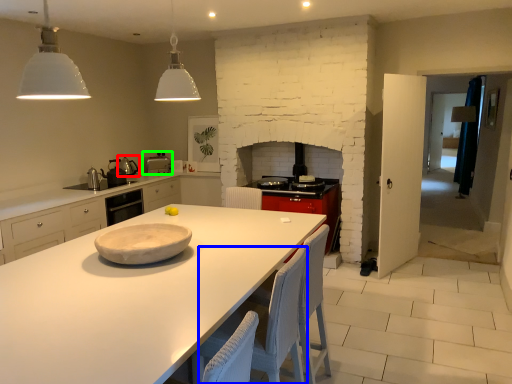
Question: Which object is the farthest from appliance (highlighted by a red box)? Choose among these: chair (highlighted by a blue box) or appliance (highlighted by a green box).

Choices:
 (A) chair
 (B) appliance

Answer: (A)